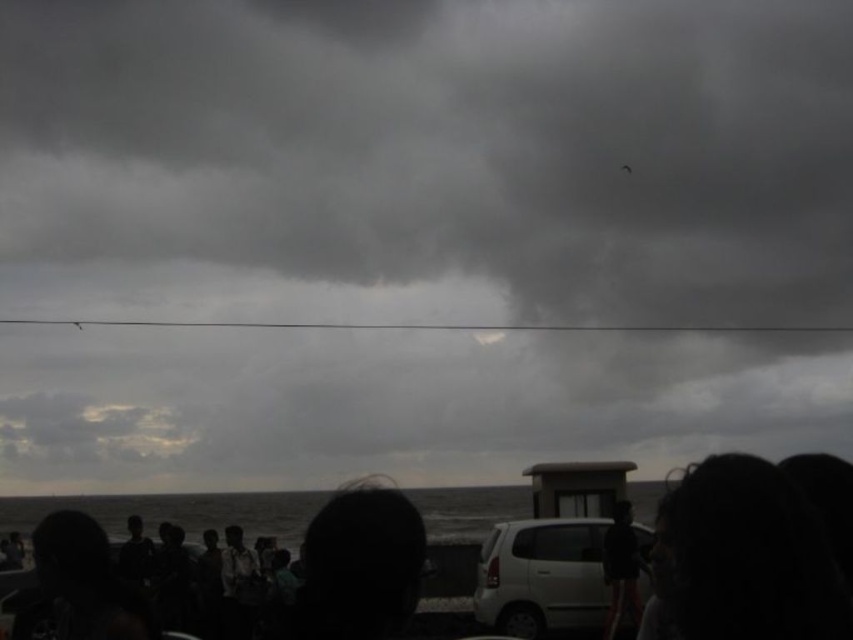
Between black matte crowd at lower center and white matte car at center, which one has more height?

black matte crowd at lower center is taller.

Who is more distant from viewer, (599, 611) or (640, 554)?

The point (599, 611) is behind.

Find the location of `black matte crowd at lower center`. black matte crowd at lower center is located at coordinates (178, 512).

Does dark hair at lower right appear under black matte crowd at lower center?

No.

Locate an element on the screen. dark hair at lower right is located at coordinates [741, 557].

Who is more distant from viewer, [727,476] or [28,513]?

Positioned behind is point [28,513].

The width and height of the screenshot is (853, 640). What are the coordinates of `dark hair at lower right` in the screenshot? It's located at (741, 557).

Is point (816, 628) in front of point (517, 612)?

Yes, point (816, 628) is closer to viewer.

Is dark hair at lower right smaller than white matte car at center?

Correct, dark hair at lower right occupies less space than white matte car at center.

Between point (709, 545) and point (573, 586), which one is positioned behind?

The point (573, 586) is more distant.

The image size is (853, 640). What are the coordinates of `dark hair at lower right` in the screenshot? It's located at (741, 557).